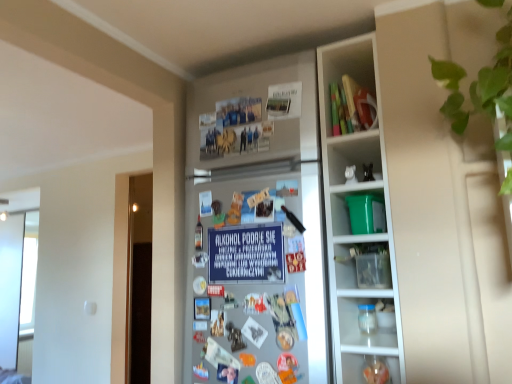
Question: Is green leafy plant at upper right inside the boundaries of green plastic bucket at upper right, the first cabinet ordered from the bottom, or outside?

Choices:
 (A) outside
 (B) inside

Answer: (A)

Question: Considering the positions of point (464, 122) and point (354, 220), is point (464, 122) closer or farther from the camera than point (354, 220)?

Choices:
 (A) closer
 (B) farther

Answer: (A)

Question: Estimate the real-world distances between objects in this image. Which object is farther from the transparent plastic jar at lower right?

Choices:
 (A) metallic refrigerator at center
 (B) blue paper sign at center
 (C) green leafy plant at upper right
 (D) matte plastic toys at upper right, the 1th cabinet positioned from the top
 (E) green plastic bucket at upper right, the first cabinet ordered from the bottom

Answer: (D)

Question: Which of these objects is positioned closest to the metallic refrigerator at center?

Choices:
 (A) blue paper sign at center
 (B) matte plastic toys at upper right, positioned as the 2th cabinet in bottom-to-top order
 (C) green plastic bucket at upper right, which is counted as the 2th cabinet, starting from the top
 (D) green leafy plant at upper right
 (E) transparent plastic jar at lower right

Answer: (A)